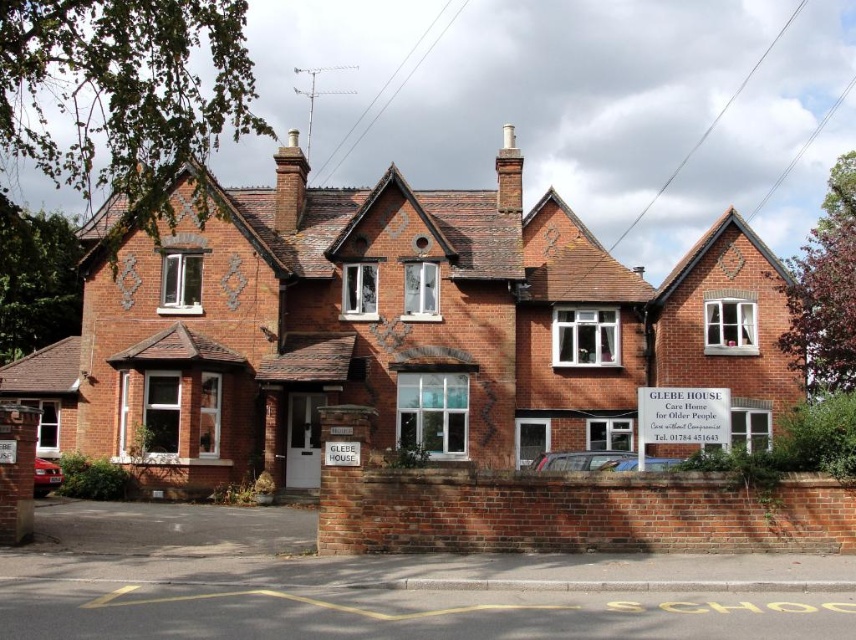
You are an architect inspecting GLEBE HOUSE. You notice two chimneys on the roof. Which chimney is closer to you, the brown brick chimney at upper center or the white brick chimney at upper center?

The brown brick chimney at upper center is closer to you because it is in front of the white brick chimney at upper center.